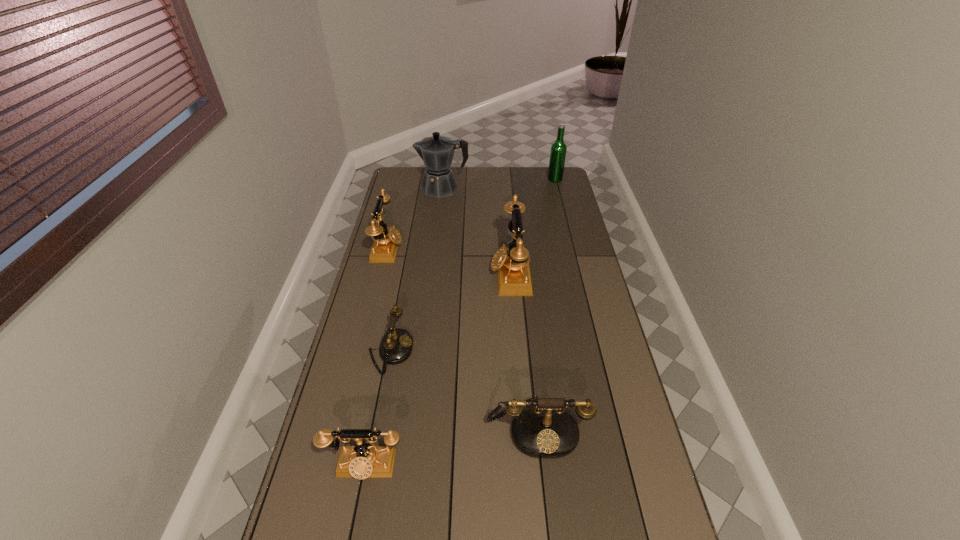
The image size is (960, 540). In order to click on vacant space situated 0.050m on the dial of the left black telephone in this screenshot , I will do `click(427, 352)`.

Locate an element on the screen. beer bottle located at the far edge is located at coordinates (558, 149).

Locate an element on the screen. coffeepot situated at the far edge is located at coordinates (437, 152).

I want to click on coffeepot situated at the left edge, so click(x=437, y=152).

At what (x,y) coordinates should I click in order to perform the action: click on beer bottle that is positioned at the right edge. Please return your answer as a coordinate pair (x, y). The width and height of the screenshot is (960, 540). Looking at the image, I should click on (558, 149).

The width and height of the screenshot is (960, 540). I want to click on telephone at the right edge, so click(544, 431).

This screenshot has height=540, width=960. Identify the location of object that is positioned at the far left corner. (437, 152).

The image size is (960, 540). What are the coordinates of `object that is at the far right corner` in the screenshot? It's located at (558, 149).

Where is `free space at the far edge`? This screenshot has height=540, width=960. free space at the far edge is located at coordinates [532, 187].

This screenshot has height=540, width=960. I want to click on free space at the left edge of the desktop, so click(389, 282).